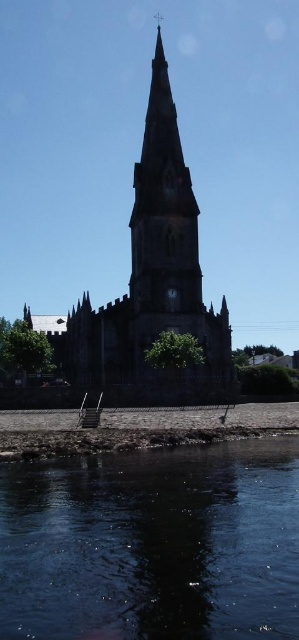
Which is behind, point (255, 449) or point (165, 148)?

Positioned behind is point (165, 148).

Can you confirm if dark blue water at lower center is positioned below smooth stone church at center?

Yes, dark blue water at lower center is below smooth stone church at center.

Between point (296, 573) and point (206, 320), which one is positioned behind?

The point (206, 320) is behind.

You are a GUI agent. You are given a task and a screenshot of the screen. Output one action in this format:
    pyautogui.click(x=<x>, y=<y>)
    Task: Click on the dark blue water at lower center
    The image size is (299, 640).
    Given the screenshot: What is the action you would take?
    pyautogui.click(x=153, y=544)

Does dark blue water at lower center have a larger size compared to metallic silver clock at center?

Indeed, dark blue water at lower center has a larger size compared to metallic silver clock at center.

Is dark blue water at lower center thinner than metallic silver clock at center?

Incorrect, dark blue water at lower center's width is not less than metallic silver clock at center's.

Locate an element on the screen. The height and width of the screenshot is (640, 299). dark blue water at lower center is located at coordinates (153, 544).

Is point (148, 320) closer to camera compared to point (170, 294)?

Yes.

Which is in front, point (133, 317) or point (174, 296)?

Point (133, 317) is in front.

The height and width of the screenshot is (640, 299). I want to click on smooth stone church at center, so click(x=153, y=284).